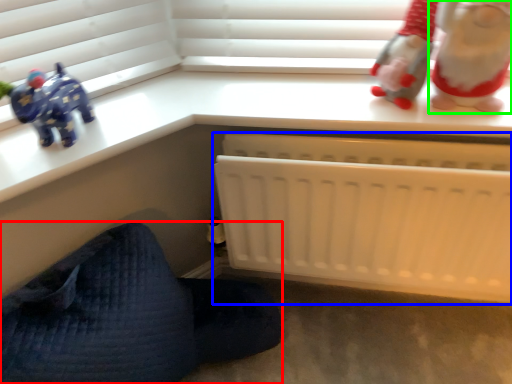
Question: Which is nearer to the furniture (highlighted by a red box)? infant bed (highlighted by a blue box) or toy (highlighted by a green box).

Choices:
 (A) infant bed
 (B) toy

Answer: (A)